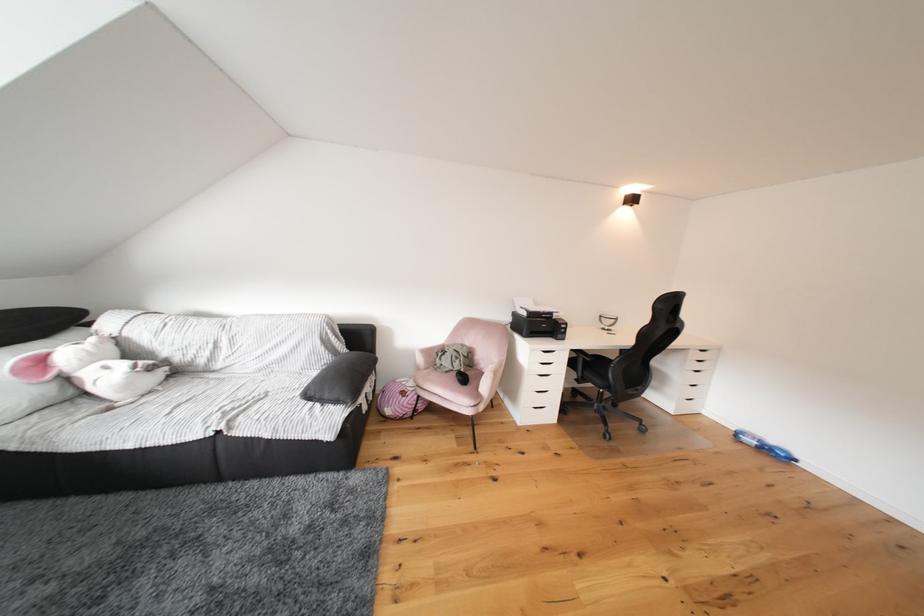
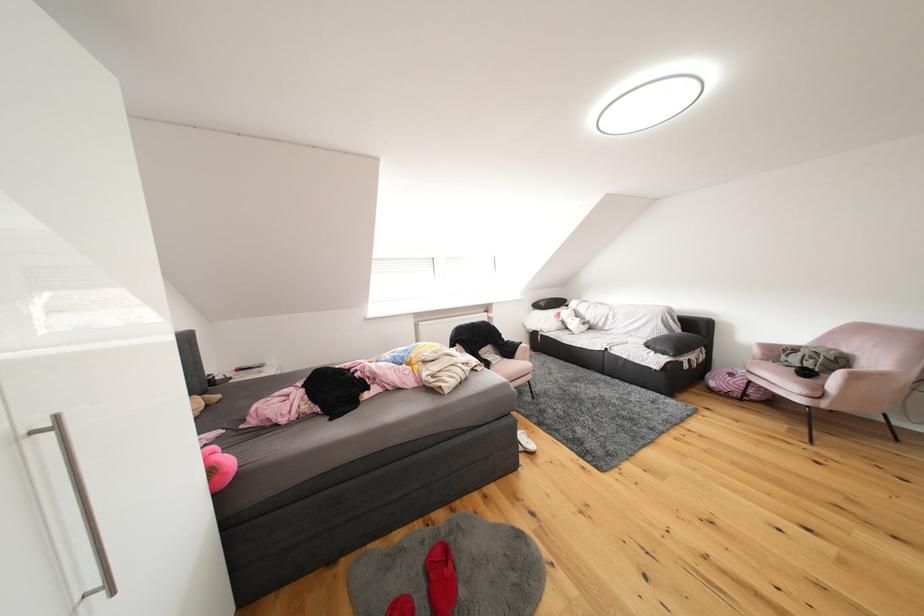
The point at (335,400) is marked in the first image. Where is the corresponding point in the second image?

(667, 351)